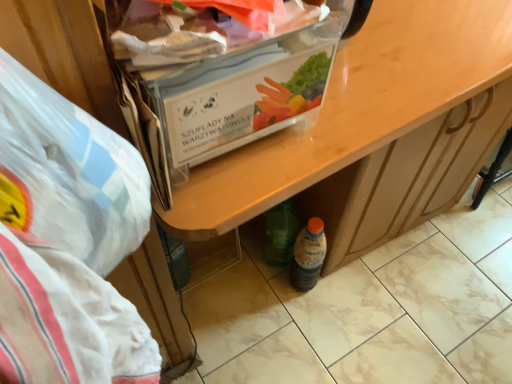
Question: Relative to wooden desk at center, is white plastic bag at left in front or behind?

Choices:
 (A) front
 (B) behind

Answer: (A)

Question: From a real-world perspective, is white plastic bag at left physically located above or below wooden desk at center?

Choices:
 (A) below
 (B) above

Answer: (B)

Question: Estimate the real-world distances between objects in this image. Which object is closer to the wooden desk at center?

Choices:
 (A) translucent plastic bottle at lower center
 (B) white plastic bag at left
 (C) clear plastic box at upper center

Answer: (C)

Question: Based on their relative distances, which object is farther from the translucent plastic bottle at lower center?

Choices:
 (A) clear plastic box at upper center
 (B) white plastic bag at left
 (C) wooden desk at center

Answer: (B)